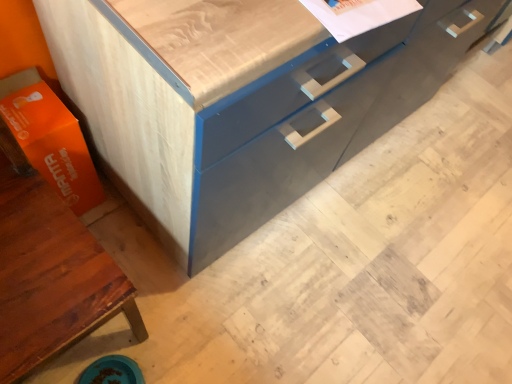
Question: From the image's perspective, does matte gray cabinet at center appear lower than orange matte cardboard box at lower left?

Choices:
 (A) no
 (B) yes

Answer: (A)

Question: Does matte gray cabinet at center have a lesser width compared to orange matte cardboard box at lower left?

Choices:
 (A) yes
 (B) no

Answer: (B)

Question: From a real-world perspective, is matte gray cabinet at center physically below orange matte cardboard box at lower left?

Choices:
 (A) no
 (B) yes

Answer: (A)

Question: Is there a large distance between matte gray cabinet at center and orange matte cardboard box at lower left?

Choices:
 (A) no
 (B) yes

Answer: (A)

Question: Considering the relative positions of matte gray cabinet at center and orange matte cardboard box at lower left in the image provided, is matte gray cabinet at center to the left of orange matte cardboard box at lower left from the viewer's perspective?

Choices:
 (A) yes
 (B) no

Answer: (B)

Question: Is matte gray cabinet at center smaller than orange matte cardboard box at lower left?

Choices:
 (A) no
 (B) yes

Answer: (A)

Question: Is there a large distance between matte wood cabinet at lower left and orange matte cardboard box at lower left?

Choices:
 (A) yes
 (B) no

Answer: (B)

Question: Does matte wood cabinet at lower left turn towards orange matte cardboard box at lower left?

Choices:
 (A) yes
 (B) no

Answer: (B)

Question: Does matte wood cabinet at lower left have a smaller size compared to orange matte cardboard box at lower left?

Choices:
 (A) no
 (B) yes

Answer: (A)

Question: Is matte wood cabinet at lower left completely or partially outside of orange matte cardboard box at lower left?

Choices:
 (A) no
 (B) yes

Answer: (B)

Question: Can you confirm if matte wood cabinet at lower left is positioned to the left of orange matte cardboard box at lower left?

Choices:
 (A) yes
 (B) no

Answer: (B)

Question: Can you see matte wood cabinet at lower left touching orange matte cardboard box at lower left?

Choices:
 (A) yes
 (B) no

Answer: (B)

Question: Is orange matte cardboard box at lower left positioned in front of matte wood cabinet at lower left?

Choices:
 (A) yes
 (B) no

Answer: (B)